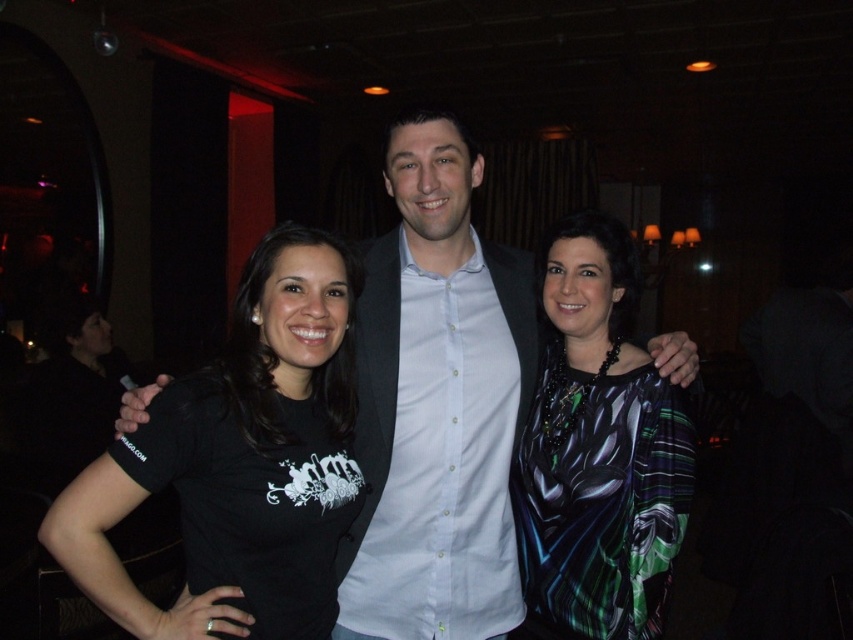
Question: Can you confirm if shiny silk blouse at center is wider than black matte t-shirt at left?

Choices:
 (A) yes
 (B) no

Answer: (B)

Question: Which object is closer to the camera taking this photo?

Choices:
 (A) white shirt at center
 (B) shiny silk blouse at center
 (C) black matte t-shirt at left

Answer: (C)

Question: Based on their relative distances, which object is nearer to the black matte t-shirt at left?

Choices:
 (A) white shirt at center
 (B) shiny silk blouse at center

Answer: (A)

Question: Which point is closer to the camera?

Choices:
 (A) (556, 524)
 (B) (294, 490)

Answer: (B)

Question: Can you confirm if shiny silk blouse at center is smaller than black matte t-shirt at left?

Choices:
 (A) yes
 (B) no

Answer: (B)

Question: Can you confirm if white shirt at center is positioned to the left of black matte t-shirt at left?

Choices:
 (A) no
 (B) yes

Answer: (A)